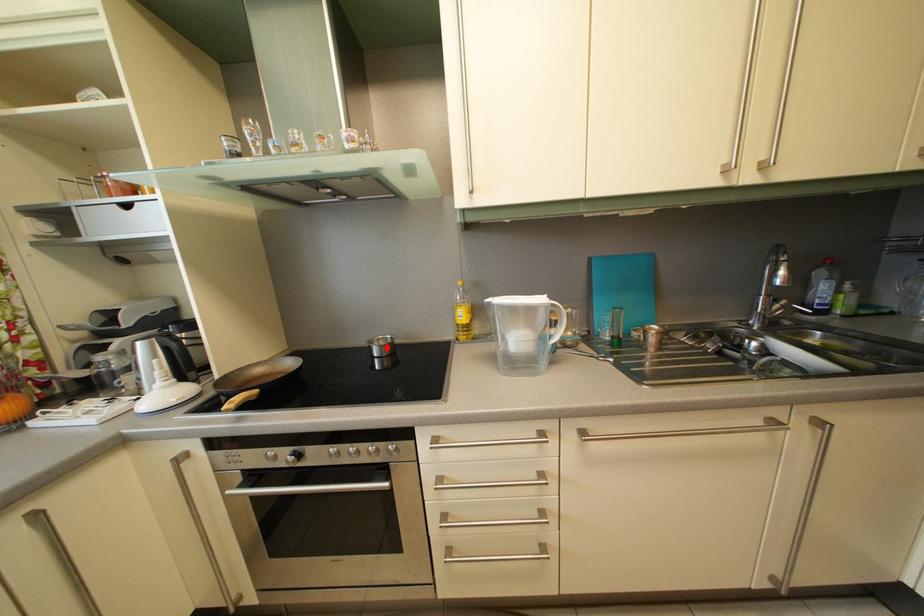
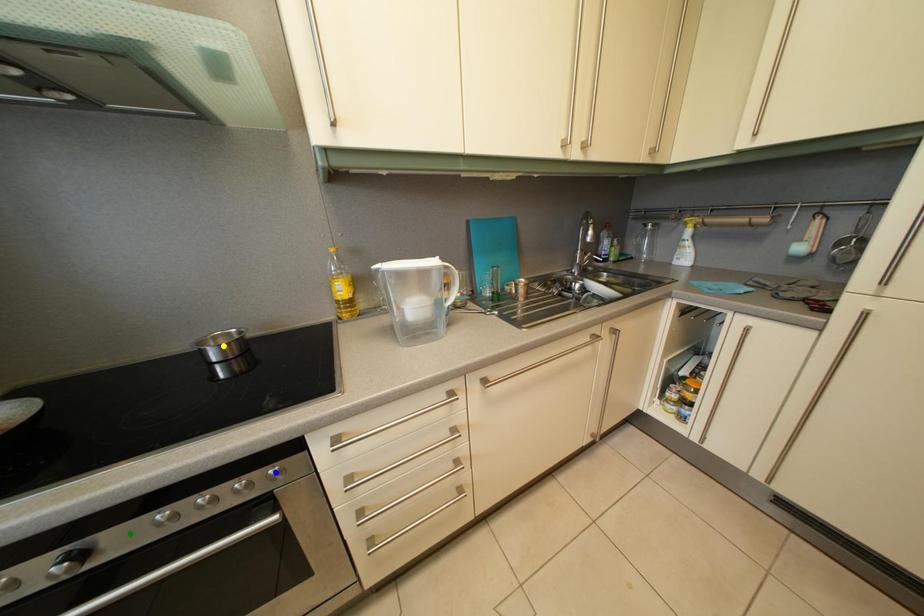
Question: I am providing you with two images of the same scene from different viewpoints. A red point is marked on the first image. You are given multiple points on the second image. Which spot in image 2 lines up with the point in image 1?

Choices:
 (A) yellow point
 (B) green point
 (C) blue point

Answer: (A)